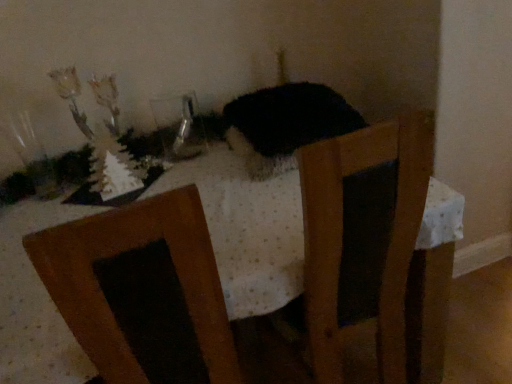
Question: In terms of height, does transparent glass vase at upper left look taller or shorter compared to fuzzy black cat at center?

Choices:
 (A) short
 (B) tall

Answer: (B)

Question: Relative to fuzzy black cat at center, is transparent glass vase at upper left in front or behind?

Choices:
 (A) behind
 (B) front

Answer: (A)

Question: Estimate the real-world distances between objects in this image. Which object is farther from the fuzzy black cat at center?

Choices:
 (A) transparent glass vase at upper left
 (B) white dotted fabric at center

Answer: (A)

Question: Which object is positioned closest to the fuzzy black cat at center?

Choices:
 (A) white dotted fabric at center
 (B) transparent glass vase at upper left

Answer: (A)